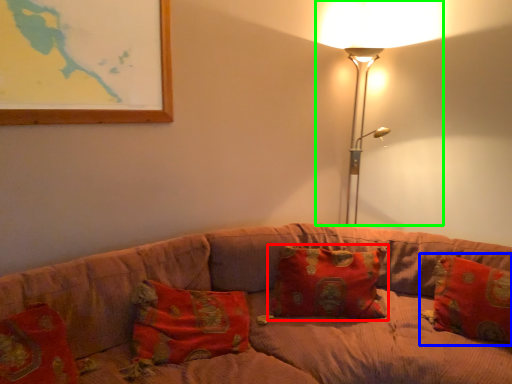
Question: Which object is the farthest from pillow (highlighted by a red box)? Choose among these: pillow (highlighted by a blue box) or lamp (highlighted by a green box).

Choices:
 (A) pillow
 (B) lamp

Answer: (B)